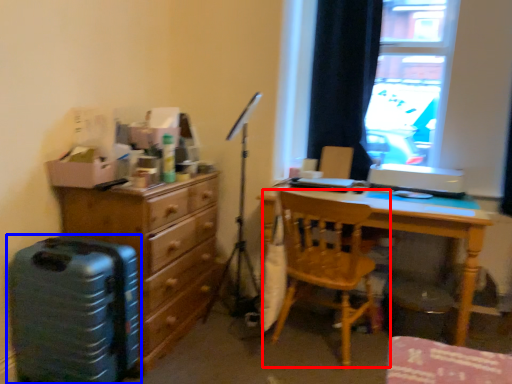
Question: Among these objects, which one is nearest to the camera, chair (highlighted by a red box) or luggage (highlighted by a blue box)?

Choices:
 (A) chair
 (B) luggage

Answer: (B)